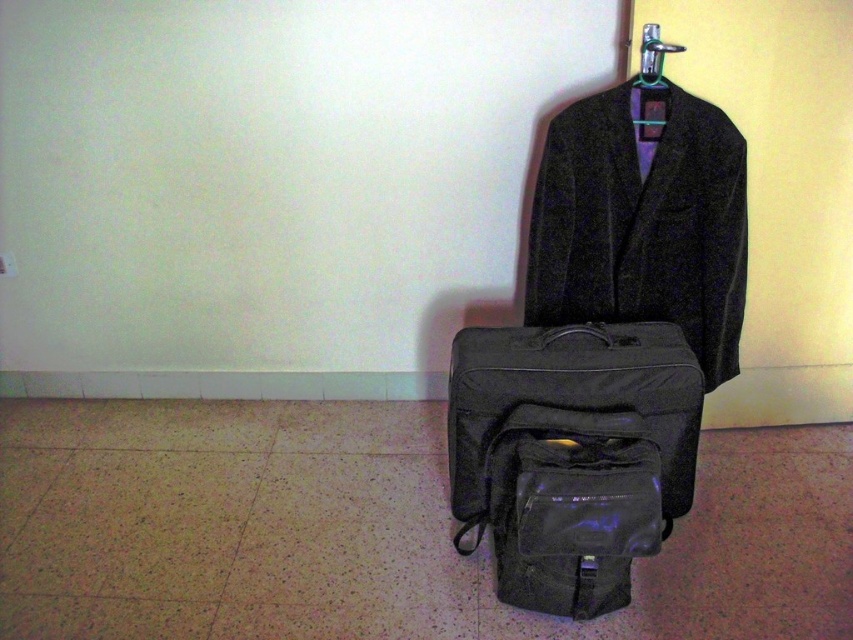
You are a GUI agent. You are given a task and a screenshot of the screen. Output one action in this format:
    pyautogui.click(x=<x>, y=<y>)
    Task: Click on the velvet black coat at upper center
    This screenshot has height=640, width=853.
    Given the screenshot: What is the action you would take?
    pyautogui.click(x=642, y=225)

Is point (666, 227) behind point (637, 81)?

Yes, point (666, 227) is farther from viewer.

You are a GUI agent. You are given a task and a screenshot of the screen. Output one action in this format:
    pyautogui.click(x=<x>, y=<y>)
    Task: Click on the velvet black coat at upper center
    This screenshot has width=853, height=640.
    Given the screenshot: What is the action you would take?
    pyautogui.click(x=642, y=225)

What do you see at coordinates (570, 400) in the screenshot?
I see `black fabric suitcase at center` at bounding box center [570, 400].

You are a GUI agent. You are given a task and a screenshot of the screen. Output one action in this format:
    pyautogui.click(x=<x>, y=<y>)
    Task: Click on the black fabric suitcase at center
    This screenshot has height=640, width=853.
    Given the screenshot: What is the action you would take?
    pyautogui.click(x=570, y=400)

The width and height of the screenshot is (853, 640). What do you see at coordinates (570, 400) in the screenshot? I see `black fabric suitcase at center` at bounding box center [570, 400].

The height and width of the screenshot is (640, 853). I want to click on black fabric suitcase at center, so click(570, 400).

Is point (633, 516) farther from viewer compared to point (634, 84)?

No, (633, 516) is closer to viewer.

Does point (485, 472) lie behind point (643, 76)?

No, it is not.

Identify the location of black fabric bag at lower center. (567, 508).